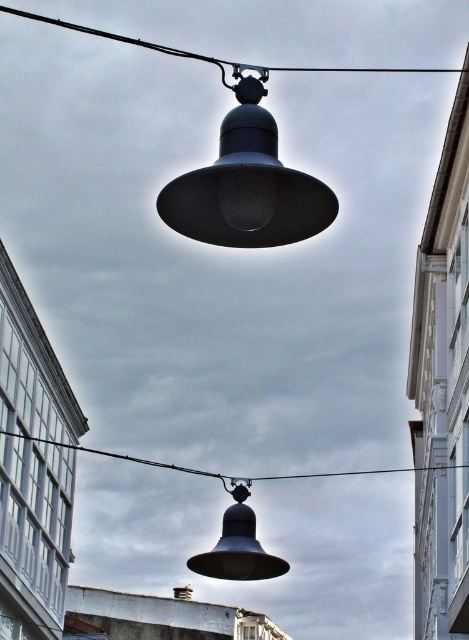
From the picture: Which is below, black wire at upper center or black wire at center?

black wire at center is lower down.

Which is above, black wire at upper center or black wire at center?

black wire at upper center is higher up.

Is point (236, 76) positioned in front of point (204, 474)?

That is True.

You are a GUI agent. You are given a task and a screenshot of the screen. Output one action in this format:
    pyautogui.click(x=<x>, y=<y>)
    Task: Click on the black wire at upper center
    
    Given the screenshot: What is the action you would take?
    pyautogui.click(x=207, y=54)

Is point (206, 561) more distant than point (322, 474)?

No, it is in front of (322, 474).

Is matte black bell at lower center wider than black wire at center?

No.

Is point (232, 480) closer to camera compared to point (209, 474)?

Yes, point (232, 480) is in front of point (209, 474).

The image size is (469, 640). In order to click on matte black bell at lower center in this screenshot , I will do `click(237, 545)`.

Is matte black lamp at upper center further to camera compared to black wire at center?

No, it is in front of black wire at center.

Between matte black lamp at upper center and black wire at center, which one appears on the right side from the viewer's perspective?

black wire at center is more to the right.

Which is in front, point (257, 141) or point (248, 484)?

Point (257, 141)

Where is `matte black lamp at upper center`? Image resolution: width=469 pixels, height=640 pixels. matte black lamp at upper center is located at coordinates (247, 182).